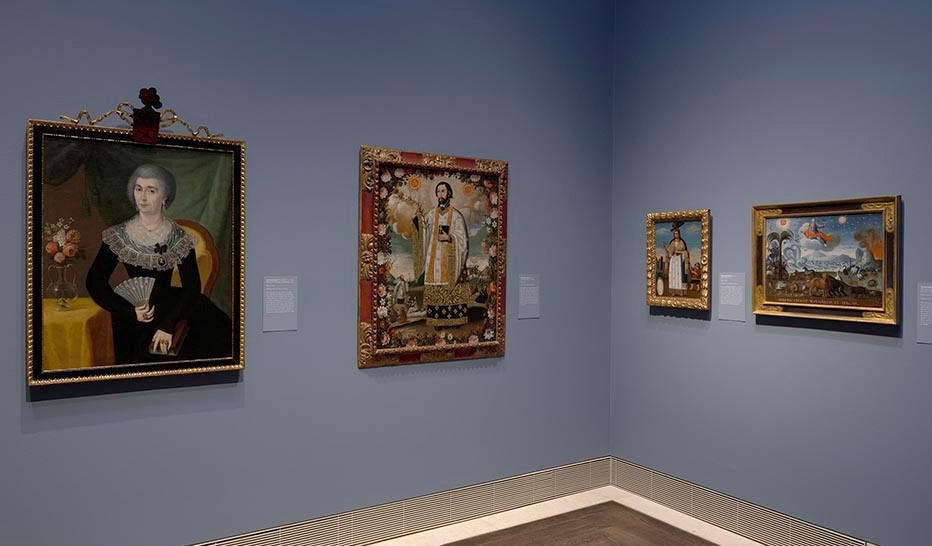
In order to click on walls in this screenshot , I will do `click(565, 363)`, `click(723, 378)`.